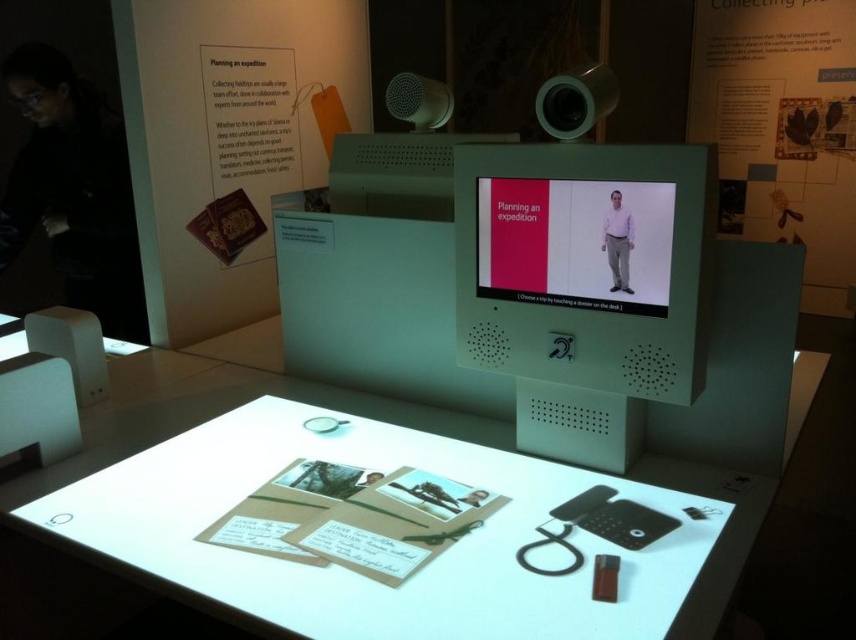
You are a visitor standing in front of the exhibit. You want to pick up the matte purple shirt at center from the white glossy table at center. Can you reach it without moving closer to the table?

The white glossy table at center is closer to the viewer than the matte purple shirt at center, so you can reach the matte purple shirt at center without needing to move closer to the table.

You are a visitor at the museum and want to read the text on the matte plastic monitor at center. Can you see it clearly from your current position in front of the black fabric at left?

Yes, the matte plastic monitor at center is in front of the black fabric at left, so you can see its text clearly from your current position in front of the black fabric at left.

You are setting up an exhibit and need to ensure that the matte plastic monitor at center is visible to visitors. Given that the black fabric at left is hanging from the ceiling, will the monitor be obscured by the fabric?

The matte plastic monitor at center is positioned under the black fabric at left, so it will be obscured by the fabric. Adjust the fabric or monitor placement to improve visibility.